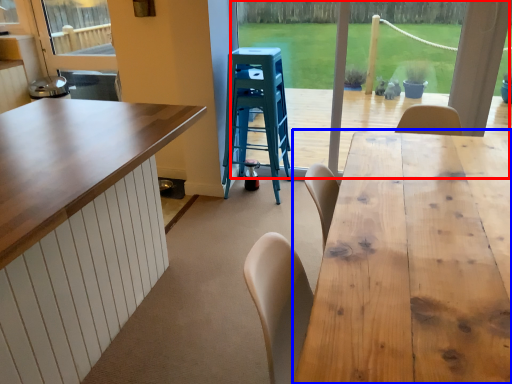
Question: Which point is further to the camera, window frame (highlighted by a red box) or table (highlighted by a blue box)?

Choices:
 (A) window frame
 (B) table

Answer: (A)